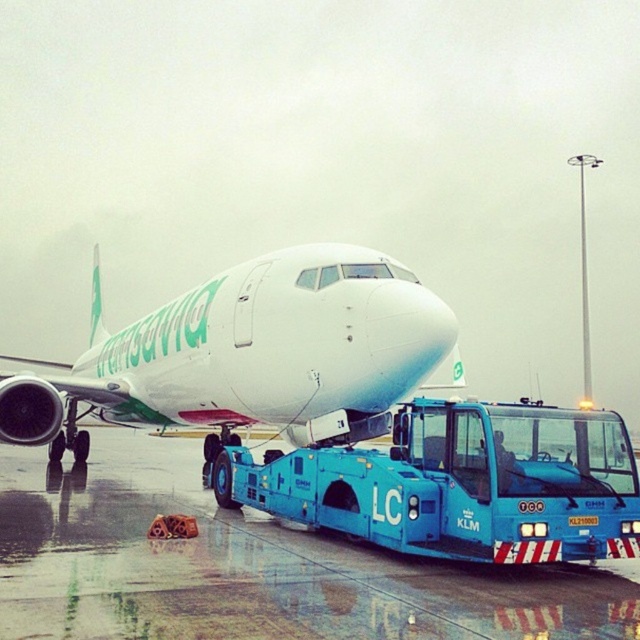
Who is positioned more to the left, white glossy airplane at upper center or blue metallic tow truck at center?

From the viewer's perspective, white glossy airplane at upper center appears more on the left side.

The width and height of the screenshot is (640, 640). I want to click on white glossy airplane at upper center, so click(244, 352).

Identify the location of white glossy airplane at upper center. This screenshot has height=640, width=640. (244, 352).

Is wet asphalt runway at lower center below blue metallic tow truck at center?

Yes.

Is point (116, 449) farther from camera compared to point (524, 401)?

Yes, point (116, 449) is farther from viewer.

Is point (112, 449) in front of point (506, 460)?

No, (112, 449) is further to viewer.

Identify the location of wet asphalt runway at lower center. (252, 566).

Who is higher up, wet asphalt runway at lower center or white glossy airplane at upper center?

white glossy airplane at upper center is above.

Does point (618, 563) come in front of point (264, 321)?

Yes, point (618, 563) is closer to viewer.

Is point (604, 595) behind point (305, 321)?

No.

At what (x,y) coordinates should I click in order to perform the action: click on wet asphalt runway at lower center. Please return your answer as a coordinate pair (x, y). Looking at the image, I should click on (252, 566).